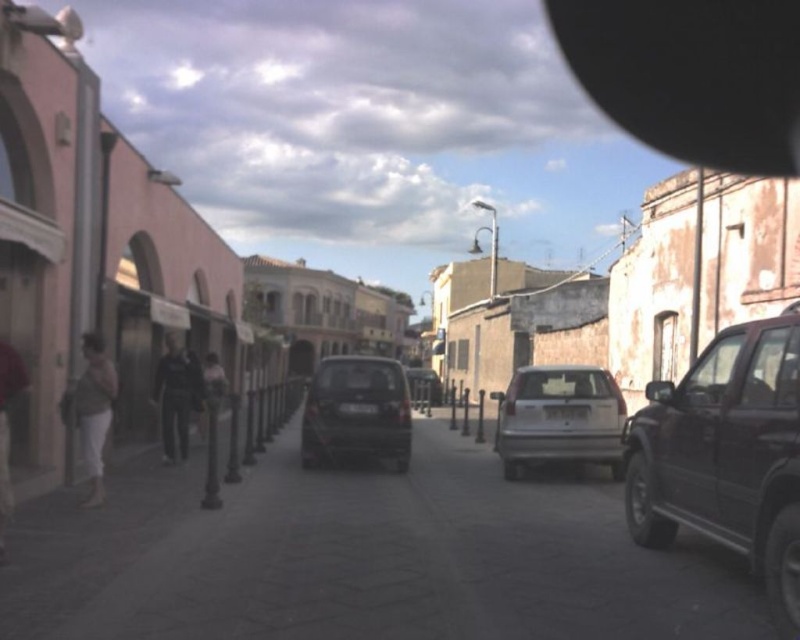
Can you confirm if gray concrete pavement at center is positioned above shiny dark gray car at center?

Actually, gray concrete pavement at center is below shiny dark gray car at center.

Is gray concrete pavement at center behind shiny dark gray car at center?

That is False.

Between point (556, 500) and point (394, 412), which one is positioned in front?

Point (556, 500) is more forward.

At what (x,y) coordinates should I click in order to perform the action: click on gray concrete pavement at center. Please return your answer as a coordinate pair (x, y). This screenshot has height=640, width=800. Looking at the image, I should click on (364, 557).

Who is higher up, dark blue uniform at center or matte gray pants at lower left?

matte gray pants at lower left

Can you confirm if dark blue uniform at center is wider than matte gray pants at lower left?

Correct, the width of dark blue uniform at center exceeds that of matte gray pants at lower left.

Does point (178, 404) lie behind point (20, 392)?

That is True.

Image resolution: width=800 pixels, height=640 pixels. Identify the location of dark blue uniform at center. (178, 394).

Who is higher up, light beige pants at lower left or matte gray pants at lower left?

Positioned higher is matte gray pants at lower left.

Looking at this image, which is below, light beige pants at lower left or matte gray pants at lower left?

light beige pants at lower left

Is point (98, 410) less distant than point (2, 408)?

No, it is not.

This screenshot has width=800, height=640. Find the location of `light beige pants at lower left`. light beige pants at lower left is located at coordinates (94, 410).